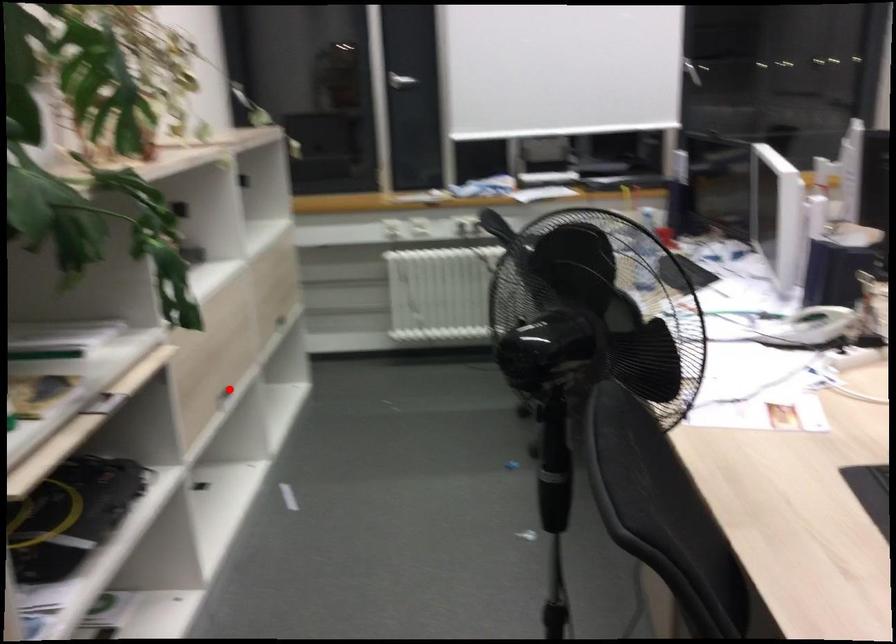
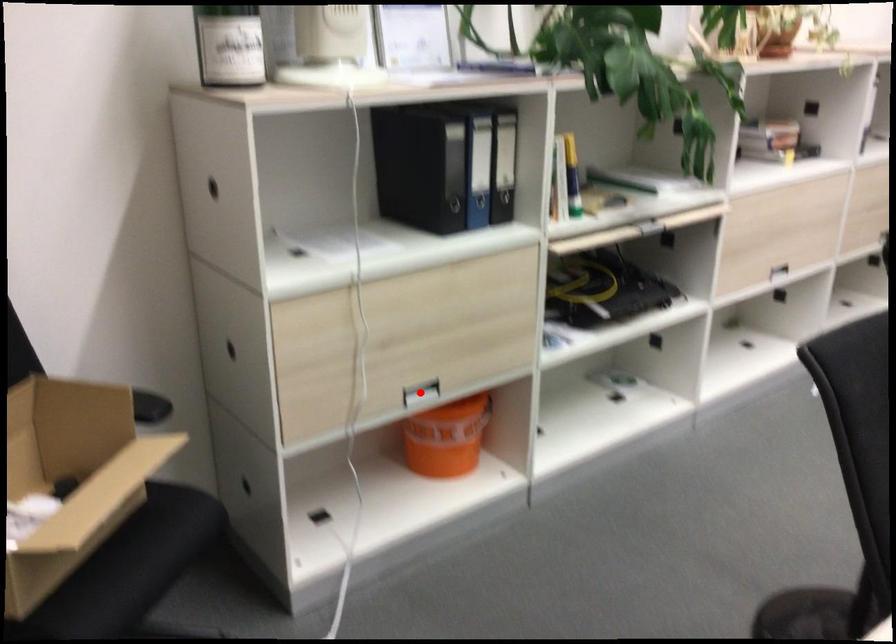
I am providing you with two images of the same scene from different viewpoints. A red point is marked on the first image and another point is marked on the second image. Do the highlighted points in image1 and image2 indicate the same real-world spot?

No